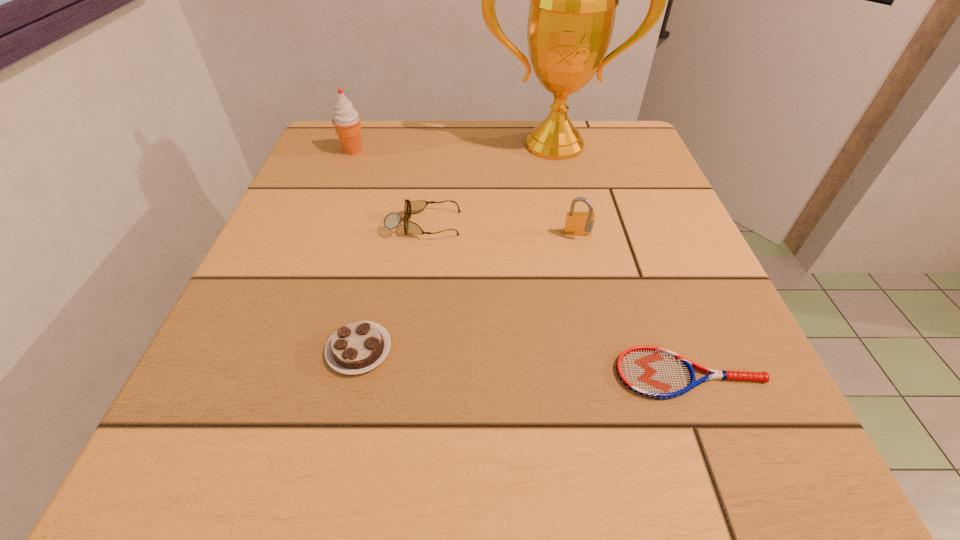
Where is `vacant space that satisfies the following two spatial constraints: 1. on the front side of the fifth shortest object; 2. on the right side of the tennis racket`? The width and height of the screenshot is (960, 540). vacant space that satisfies the following two spatial constraints: 1. on the front side of the fifth shortest object; 2. on the right side of the tennis racket is located at coordinates (268, 374).

In order to click on free space that satisfies the following two spatial constraints: 1. on the front-facing side of the third shortest object; 2. on the left side of the tennis racket in this screenshot , I will do `click(403, 374)`.

Identify the location of free spot that satisfies the following two spatial constraints: 1. on the front-facing side of the third shortest object; 2. on the front side of the chocolate cake. (407, 350).

This screenshot has height=540, width=960. I want to click on vacant region that satisfies the following two spatial constraints: 1. on the front-facing side of the third shortest object; 2. on the right side of the shortest object, so click(403, 374).